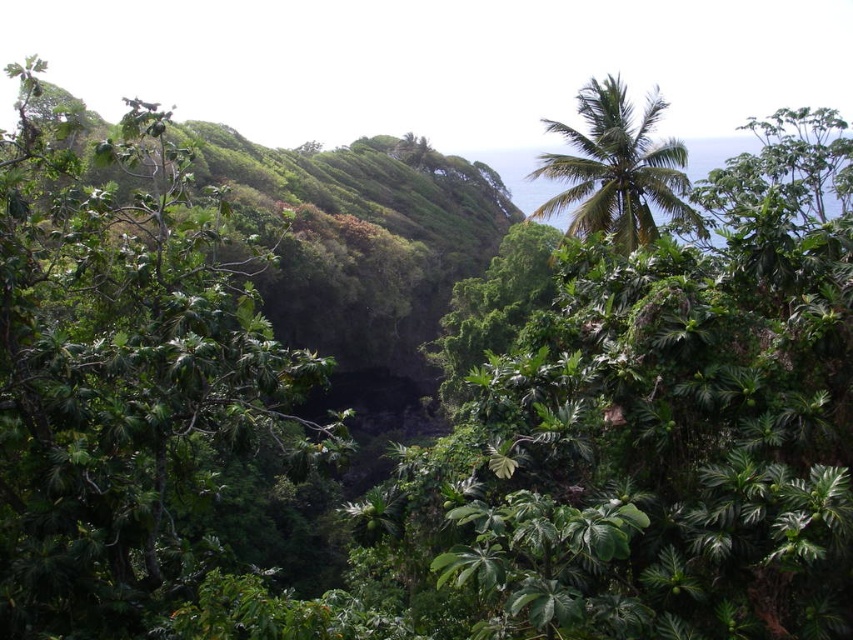
Does green leafy tree at center come behind green leafy palm tree at upper right?

No, it is not.

Where is `green leafy tree at center`? This screenshot has width=853, height=640. green leafy tree at center is located at coordinates (123, 376).

The width and height of the screenshot is (853, 640). I want to click on green leafy tree at center, so click(123, 376).

Identify the location of green leafy tree at center. (123, 376).